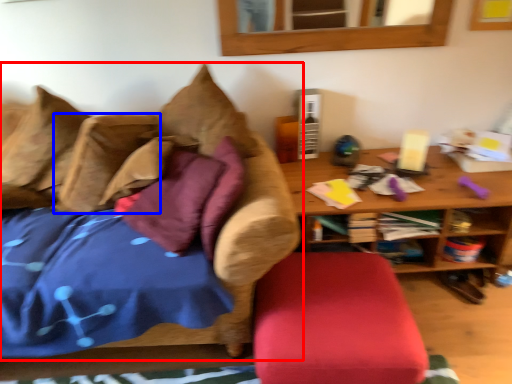
Question: Which point is further to the camera, studio couch (highlighted by a red box) or pillow (highlighted by a blue box)?

Choices:
 (A) studio couch
 (B) pillow

Answer: (B)